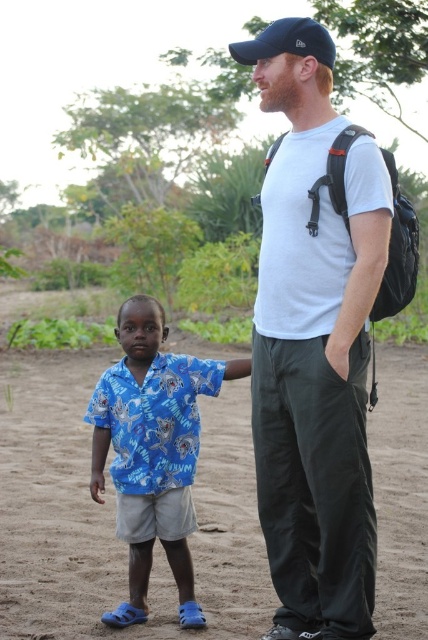
Question: Does brown sandy dirt at lower left have a smaller size compared to navy blue fabric baseball cap at upper center?

Choices:
 (A) yes
 (B) no

Answer: (B)

Question: Is brown sandy dirt at lower left behind white matte t-shirt at center?

Choices:
 (A) no
 (B) yes

Answer: (B)

Question: Which point is farther to the camera?

Choices:
 (A) blue printed shirt at center
 (B) white matte t-shirt at center
 (C) brown sandy dirt at lower left
 (D) navy blue fabric baseball cap at upper center

Answer: (C)

Question: Is brown sandy dirt at lower left to the left of white matte t-shirt at center from the viewer's perspective?

Choices:
 (A) yes
 (B) no

Answer: (A)

Question: Which object appears farthest from the camera in this image?

Choices:
 (A) blue printed shirt at center
 (B) white matte t-shirt at center
 (C) brown sandy dirt at lower left
 (D) navy blue fabric baseball cap at upper center

Answer: (C)

Question: Which object appears closest to the camera in this image?

Choices:
 (A) blue printed shirt at center
 (B) white matte t-shirt at center
 (C) brown sandy dirt at lower left

Answer: (B)